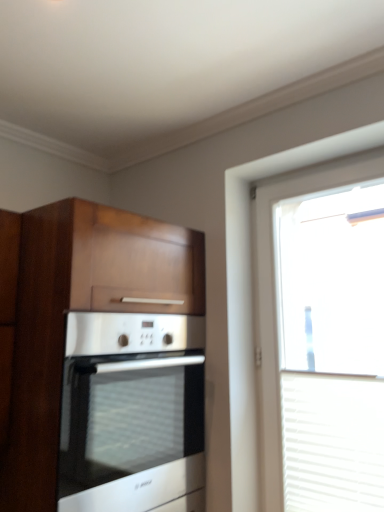
Question: Would you say satin silver oven at center is to the left or to the right of transparent glass window at right in the picture?

Choices:
 (A) left
 (B) right

Answer: (A)

Question: Is satin silver oven at center bigger or smaller than transparent glass window at right?

Choices:
 (A) small
 (B) big

Answer: (B)

Question: Based on their relative distances, which object is farther from the wooden cabinet at left?

Choices:
 (A) transparent glass window at right
 (B) white plastic blinds at right
 (C) satin silver oven at center

Answer: (B)

Question: Which is nearer to the white plastic blinds at right?

Choices:
 (A) wooden cabinet at left
 (B) transparent glass window at right
 (C) satin silver oven at center

Answer: (B)